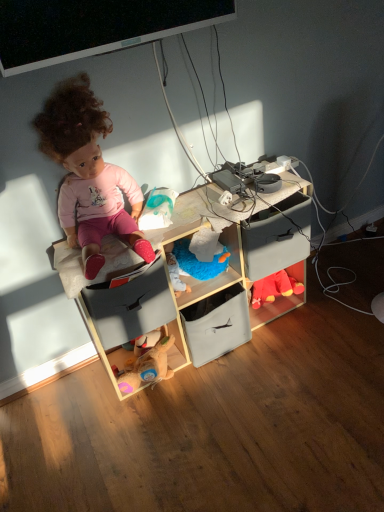
Question: From the image's perspective, is matte pink doll at upper left above or below matte gray drawer at center, which appears as the 2th drawer when viewed from the left?

Choices:
 (A) below
 (B) above

Answer: (B)

Question: Based on their positions, is matte pink doll at upper left located to the left or right of matte gray drawer at center, which is the 1th drawer in right-to-left order?

Choices:
 (A) right
 (B) left

Answer: (B)

Question: Based on their relative distances, which object is nearer to the soft fabric storage at center, marked as the first shelf in a right-to-left arrangement?

Choices:
 (A) matte plastic drawer at center, the 2th drawer when ordered from right to left
 (B) matte gray drawer at center, which appears as the 2th drawer when viewed from the left
 (C) wooden cube at center, arranged as the 1th shelf when viewed from the left
 (D) matte plastic bag at center, the first toy in the left-to-right sequence
 (E) black glossy monitor at upper center

Answer: (C)

Question: Which of these objects is positioned closest to the matte pink doll at upper left?

Choices:
 (A) matte plastic drawer at center, the 2th drawer when ordered from right to left
 (B) velvet red plush toy at lower right, the first toy in the right-to-left sequence
 (C) wooden cube at center, the second shelf from the right
 (D) matte plastic bag at center, placed as the 1th toy when sorted from front to back
 (E) black glossy monitor at upper center

Answer: (D)